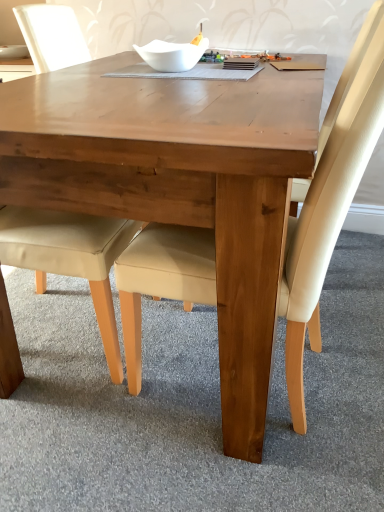
Question: Is white glossy bowl at upper center not within beige leather chair at lower left, which is the 2th chair from right to left?

Choices:
 (A) yes
 (B) no

Answer: (A)

Question: Considering the relative sizes of white glossy bowl at upper center and beige leather chair at lower left, which is the 2th chair from right to left, in the image provided, is white glossy bowl at upper center smaller than beige leather chair at lower left, which is the 2th chair from right to left,?

Choices:
 (A) no
 (B) yes

Answer: (B)

Question: From a real-world perspective, is white glossy bowl at upper center located beneath beige leather chair at lower left, the first chair positioned from the left?

Choices:
 (A) yes
 (B) no

Answer: (B)

Question: Could you tell me if white glossy bowl at upper center is turned towards beige leather chair at lower left, the first chair positioned from the left?

Choices:
 (A) yes
 (B) no

Answer: (B)

Question: Are white glossy bowl at upper center and beige leather chair at lower left, the first chair positioned from the left, far apart?

Choices:
 (A) yes
 (B) no

Answer: (B)

Question: Is the position of white glossy bowl at upper center less distant than that of beige leather chair at lower left, the first chair positioned from the left?

Choices:
 (A) yes
 (B) no

Answer: (B)

Question: Is beige leather chair at center, which is counted as the 1th chair, starting from the right, not within beige leather chair at lower left, which is the 2th chair from right to left?

Choices:
 (A) yes
 (B) no

Answer: (A)

Question: Is beige leather chair at center, which is counted as the 1th chair, starting from the right, positioned in front of beige leather chair at lower left, the first chair positioned from the left?

Choices:
 (A) no
 (B) yes

Answer: (B)

Question: Is beige leather chair at center, which is counted as the 1th chair, starting from the right, at the left side of beige leather chair at lower left, the first chair positioned from the left?

Choices:
 (A) yes
 (B) no

Answer: (B)

Question: Is the position of beige leather chair at center, which is the 2th chair in left-to-right order, more distant than that of beige leather chair at lower left, which is the 2th chair from right to left?

Choices:
 (A) yes
 (B) no

Answer: (B)

Question: Considering the relative positions of beige leather chair at center, which is counted as the 1th chair, starting from the right, and beige leather chair at lower left, which is the 2th chair from right to left, in the image provided, is beige leather chair at center, which is counted as the 1th chair, starting from the right, to the right of beige leather chair at lower left, which is the 2th chair from right to left, from the viewer's perspective?

Choices:
 (A) no
 (B) yes

Answer: (B)

Question: Is beige leather chair at center, which is the 2th chair in left-to-right order, not near beige leather chair at lower left, the first chair positioned from the left?

Choices:
 (A) no
 (B) yes

Answer: (A)

Question: Is wooden table at center at the right side of white glossy bowl at upper center?

Choices:
 (A) no
 (B) yes

Answer: (A)